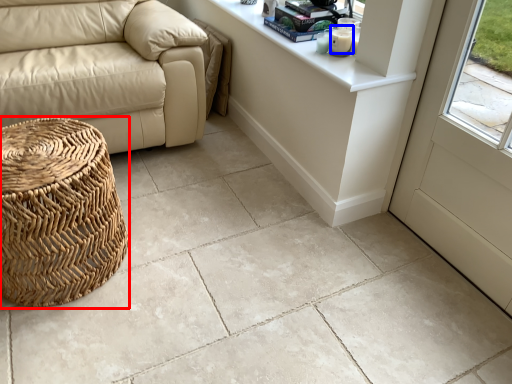
Question: Among these objects, which one is nearest to the camera, basket (highlighted by a red box) or candle (highlighted by a blue box)?

Choices:
 (A) basket
 (B) candle

Answer: (A)